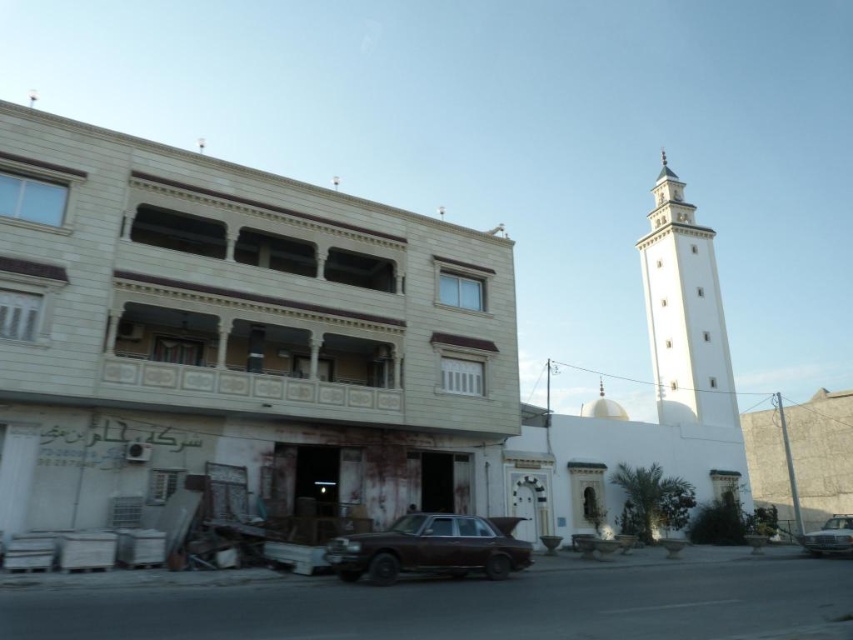
You are a pedestrian standing on the sidewalk and want to cross the street. There are two cars in the middle of the road, a brown matte car at center and a brown metallic car at center. Which car is closer to you?

The brown matte car at center is closer to you since it is positioned in front of the brown metallic car at center.